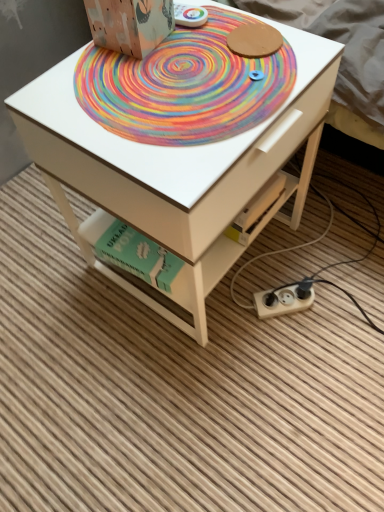
Identify the location of vacant area on top of rainbow painted mat at center (from a real-world perspective). The height and width of the screenshot is (512, 384). (187, 62).